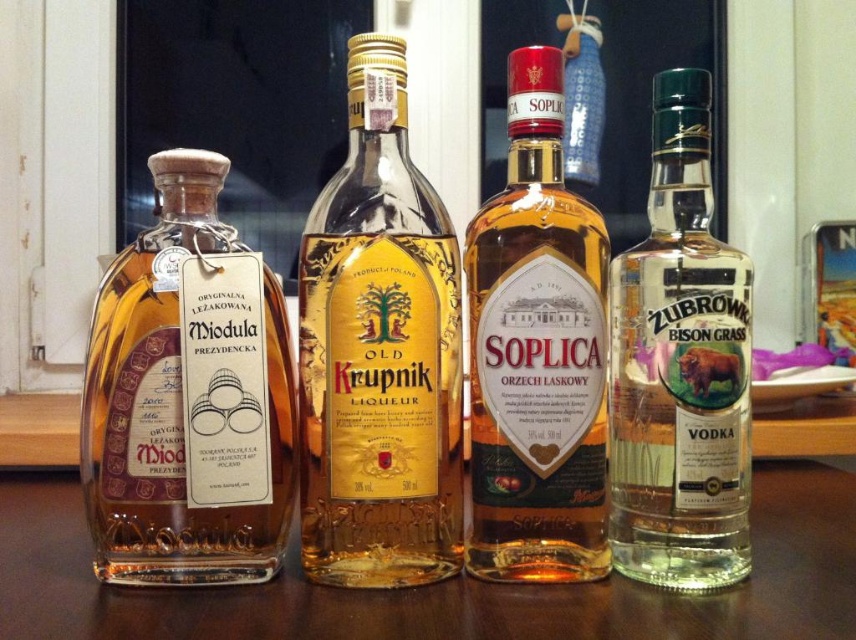
Which direction is the amber glass bottle at left relative to the point marked at coordinates (187, 397)?

The amber glass bottle at left is located at the point marked at coordinates (187, 397).

You are a bartender preparing a cocktail that requires precise measurements. You have an amber glass bottle at left and a clear glass vodka at right. Which bottle has a wider opening to allow for easier pouring?

The amber glass bottle at left has a larger width than the clear glass vodka at right, so it has a wider opening for easier pouring.

You are arranging drinks for a party and need to place the amber glass bottle at center and the clear glass vodka at right in a specific order. According to the image, which one should be placed to the left of the other?

The amber glass bottle at center should be placed to the left of the clear glass vodka at right because the description states that the amber glass bottle at center is to the left of the clear glass vodka at right.